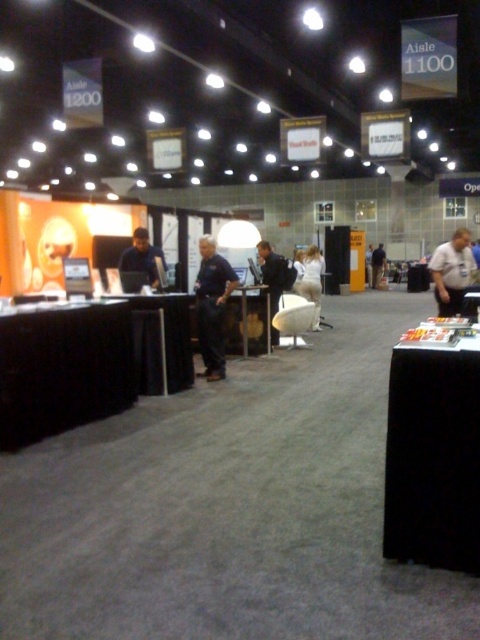
Question: Based on their relative distances, which object is nearer to the matte black shirt at center?

Choices:
 (A) black fabric table at lower left
 (B) black plastic table at center
 (C) dark blue shirt at center
 (D) white fabric pants at center

Answer: (A)

Question: Is blue fabric pants at center smaller than matte black shirt at center?

Choices:
 (A) yes
 (B) no

Answer: (B)

Question: Does blue fabric pants at center lie in front of dark blue jeans at center?

Choices:
 (A) no
 (B) yes

Answer: (B)

Question: Which of the following is the closest to the observer?

Choices:
 (A) black fabric table at lower left
 (B) black plastic table at center

Answer: (A)

Question: Is black fabric table at lower right positioned behind white fabric pants at center?

Choices:
 (A) no
 (B) yes

Answer: (A)

Question: Among these points, which one is farthest from the camera?

Choices:
 (A) (451, 449)
 (B) (245, 288)
 (C) (302, 289)
 (D) (376, 262)

Answer: (D)